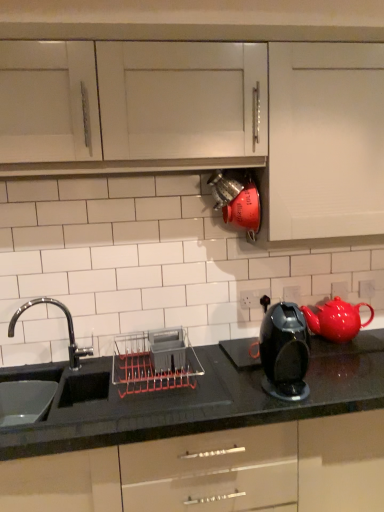
This screenshot has width=384, height=512. What do you see at coordinates (326, 140) in the screenshot?
I see `white matte cabinet at upper right` at bounding box center [326, 140].

This screenshot has height=512, width=384. What do you see at coordinates (154, 362) in the screenshot?
I see `gray plastic dish rack at center` at bounding box center [154, 362].

You are a GUI agent. You are given a task and a screenshot of the screen. Output one action in this format:
    pyautogui.click(x=<x>, y=<y>)
    Task: Click on the black glossy countertop at lower center
    
    Given the screenshot: What is the action you would take?
    pyautogui.click(x=192, y=399)

What do you see at coordinates (237, 200) in the screenshot? I see `matte red kettle at center` at bounding box center [237, 200].

What are the coordinates of `white matte cabinet at upper right` in the screenshot? It's located at (326, 140).

Looking at this image, is matte red kettle at center surrounding black glossy countertop at lower center?

Actually, black glossy countertop at lower center is outside matte red kettle at center.

Is point (228, 201) more distant than point (84, 410)?

Yes, it is behind point (84, 410).

Considering the relative sizes of matte red kettle at center and black glossy countertop at lower center in the image provided, is matte red kettle at center smaller than black glossy countertop at lower center?

Yes.

Considering their positions, is matte red kettle at center located in front of or behind black glossy countertop at lower center?

Clearly, matte red kettle at center is behind black glossy countertop at lower center.

Can you confirm if gray plastic dish rack at center is thinner than red glossy teapot at right?

In fact, gray plastic dish rack at center might be wider than red glossy teapot at right.

Is the position of gray plastic dish rack at center less distant than that of red glossy teapot at right?

Yes, gray plastic dish rack at center is closer to the viewer.

Between gray plastic dish rack at center and red glossy teapot at right, which one has larger size?

gray plastic dish rack at center.

Are black glossy countertop at lower center and gray plastic dish rack at center far apart?

No, black glossy countertop at lower center is not far from gray plastic dish rack at center.

From the image's perspective, is black glossy countertop at lower center beneath gray plastic dish rack at center?

Yes.

Is black glossy countertop at lower center smaller than gray plastic dish rack at center?

No, black glossy countertop at lower center is not smaller than gray plastic dish rack at center.

Can you confirm if black glossy countertop at lower center is positioned to the left of gray plastic dish rack at center?

No, black glossy countertop at lower center is not to the left of gray plastic dish rack at center.

From a real-world perspective, which is physically above, red glossy teapot at right or white matte cabinet at upper right?

white matte cabinet at upper right is physically above.

Can you tell me how much red glossy teapot at right and white matte cabinet at upper right differ in facing direction?

red glossy teapot at right and white matte cabinet at upper right are facing 1.29 degrees away from each other.

From the image's perspective, does red glossy teapot at right appear lower than white matte cabinet at upper right?

Yes.

Considering the sizes of objects red glossy teapot at right and white matte cabinet at upper right in the image provided, who is wider, red glossy teapot at right or white matte cabinet at upper right?

white matte cabinet at upper right.

Is white matte cabinet at upper right at the back of gray plastic dish rack at center?

No, gray plastic dish rack at center's orientation is not away from white matte cabinet at upper right.

Is gray plastic dish rack at center situated inside white matte cabinet at upper right or outside?

gray plastic dish rack at center cannot be found inside white matte cabinet at upper right.

Image resolution: width=384 pixels, height=512 pixels. Find the location of `kitchen appliance below the white matte cabinet at upper right (from a real-world perspective)`. kitchen appliance below the white matte cabinet at upper right (from a real-world perspective) is located at coordinates (154, 362).

Based on their sizes in the image, would you say gray plastic dish rack at center is bigger or smaller than white matte cabinet at upper right?

Considering their sizes, gray plastic dish rack at center takes up less space than white matte cabinet at upper right.

The height and width of the screenshot is (512, 384). In order to click on appliance above the gray plastic dish rack at center (from a real-world perspective) in this screenshot , I will do pyautogui.click(x=237, y=200).

Is gray plastic dish rack at center positioned behind matte red kettle at center?

No.

Is gray plastic dish rack at center smaller than matte red kettle at center?

Correct, gray plastic dish rack at center occupies less space than matte red kettle at center.

From the image's perspective, which one is positioned higher, gray plastic dish rack at center or matte red kettle at center?

matte red kettle at center.

From the picture: Looking at their sizes, would you say white matte cabinet at upper right is wider or thinner than black glossy countertop at lower center?

Clearly, white matte cabinet at upper right has less width compared to black glossy countertop at lower center.

In the image, is white matte cabinet at upper right on the left side or the right side of black glossy countertop at lower center?

A: Based on their positions, white matte cabinet at upper right is located to the right of black glossy countertop at lower center.

In order to click on countertop in front of the white matte cabinet at upper right in this screenshot , I will do `click(192, 399)`.

Is black glossy countertop at lower center inside white matte cabinet at upper right?

No, white matte cabinet at upper right does not contain black glossy countertop at lower center.

Find the location of a particular element. The image size is (384, 512). countertop on the left of matte red kettle at center is located at coordinates (192, 399).

What are the coordinates of `tea pot on the right of gray plastic dish rack at center` in the screenshot? It's located at (336, 319).

Which object lies nearer to the anchor point white matte cabinet at upper right, red glossy teapot at right or gray plastic dish rack at center?

Based on the image, red glossy teapot at right appears to be nearer to white matte cabinet at upper right.

When comparing their distances from black glossy countertop at lower center, does glossy black coffee maker at center-right or matte red kettle at center seem closer?

The object closer to black glossy countertop at lower center is glossy black coffee maker at center-right.

Which object lies further to the anchor point gray plastic dish rack at center, black glossy countertop at lower center or glossy black coffee maker at center-right?

glossy black coffee maker at center-right.

From the image, which object appears to be farther from black glossy countertop at lower center, red glossy teapot at right or white matte cabinet at upper right?

white matte cabinet at upper right lies further to black glossy countertop at lower center than the other object.

From the image, which object appears to be nearer to white matte cabinet at upper right, gray plastic dish rack at center or red glossy teapot at right?

red glossy teapot at right is closer to white matte cabinet at upper right.

Considering their positions, is glossy black coffee maker at center-right positioned further to black glossy countertop at lower center than white matte cabinet at upper right?

Answer: Among the two, white matte cabinet at upper right is located further to black glossy countertop at lower center.

Considering their positions, is matte red kettle at center positioned further to gray plastic dish rack at center than black glossy countertop at lower center?

matte red kettle at center.

Based on their spatial positions, is glossy black coffee maker at center-right or matte red kettle at center further from red glossy teapot at right?

Based on the image, matte red kettle at center appears to be further to red glossy teapot at right.

Locate an element on the screen. Image resolution: width=384 pixels, height=512 pixels. tea pot that lies between white matte cabinet at upper right and black glossy countertop at lower center from top to bottom is located at coordinates (336, 319).

Image resolution: width=384 pixels, height=512 pixels. In order to click on home appliance located between gray plastic dish rack at center and red glossy teapot at right in the left-right direction in this screenshot , I will do `click(284, 350)`.

You are a GUI agent. You are given a task and a screenshot of the screen. Output one action in this format:
    pyautogui.click(x=<x>, y=<y>)
    Task: Click on the kitchen appliance between glossy black coffee maker at center-right and black glossy countertop at lower center vertically
    
    Given the screenshot: What is the action you would take?
    pyautogui.click(x=154, y=362)

Find the location of a particular element. The width and height of the screenshot is (384, 512). home appliance between white matte cabinet at upper right and gray plastic dish rack at center from top to bottom is located at coordinates (284, 350).